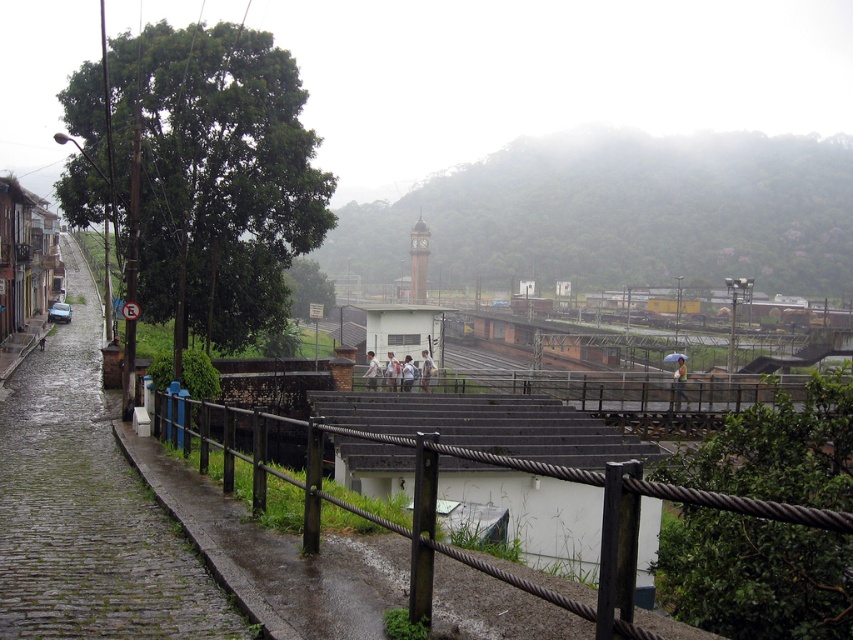
Question: Which point is closer to the camera?

Choices:
 (A) brown stone clock tower at center
 (B) green leafy hillside at center
 (C) white fabric at center

Answer: (C)

Question: Can you confirm if white fabric at center is wider than light brown leather jacket at center?

Choices:
 (A) no
 (B) yes

Answer: (B)

Question: Considering the relative positions of brown stone clock tower at center and white cotton shirt at center in the image provided, where is brown stone clock tower at center located with respect to white cotton shirt at center?

Choices:
 (A) left
 (B) right

Answer: (B)

Question: Which point is closer to the camera taking this photo?

Choices:
 (A) (799, 616)
 (B) (679, 364)

Answer: (A)

Question: Which is farther from the white fabric at center?

Choices:
 (A) brown stone clock tower at center
 (B) yellow fabric umbrella at center

Answer: (A)

Question: Does light brown leather jacket at center appear under light gray fabric shirt at center?

Choices:
 (A) no
 (B) yes

Answer: (A)